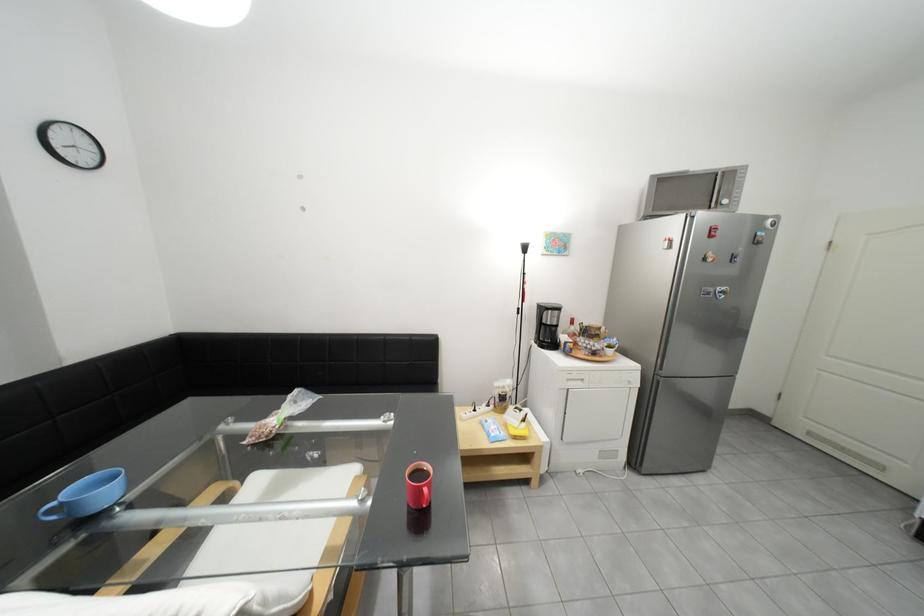
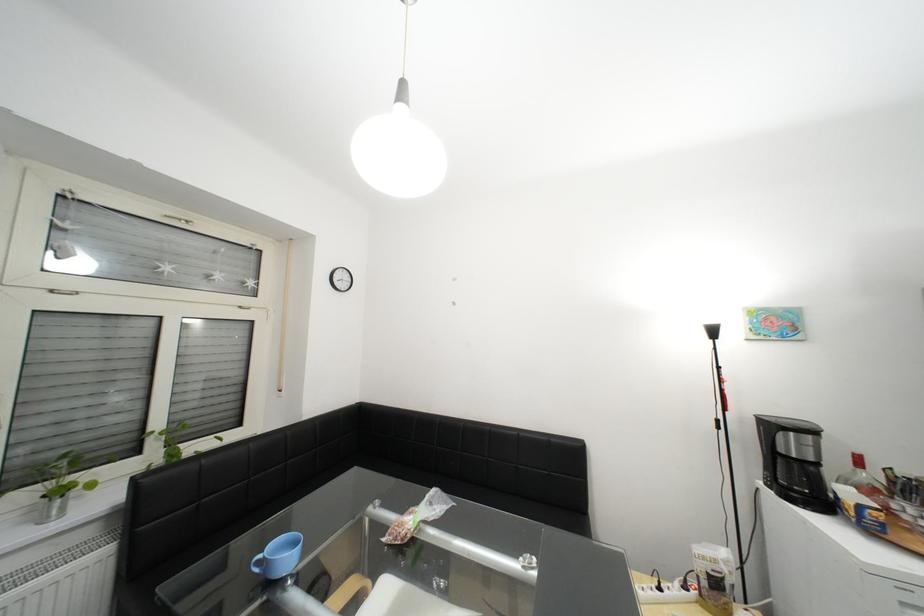
How did the camera likely rotate?

The rotation direction of the camera is left-up.